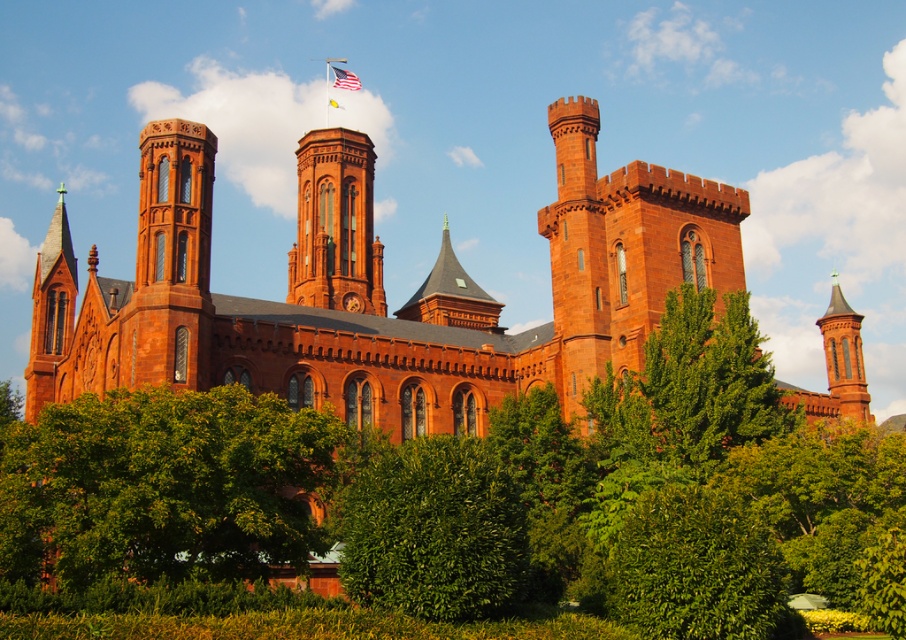
You are a visitor standing in front of the Smithsonian Castle and want to take a photo of the matte brick tower at center. To avoid blocking the tower in your photo, should you move to the left or right of the green leafy tree at lower left?

The green leafy tree at lower left is positioned on the right side of matte brick tower at center. To avoid blocking the tower, you should move to the right of the green leafy tree at lower left so that the tree is between you and the tower, allowing the tower to remain visible in the photo.

You are a tourist standing in front of the Smithsonian Castle. You notice a green leafy tree at lower left and a matte brick tower at center. Which object is closer to you as you stand there?

The green leafy tree at lower left is closer to you because it is in front of the matte brick tower at center.

You are a photographer planning to capture the Smithsonian Castle from a specific angle. You want to ensure that the matte brick tower at right and the silky fabric flag at upper center are both visible in your shot. Based on their heights, which object will appear taller in the photograph?

The matte brick tower at right will appear taller in the photograph because it has a greater height compared to the silky fabric flag at upper center.